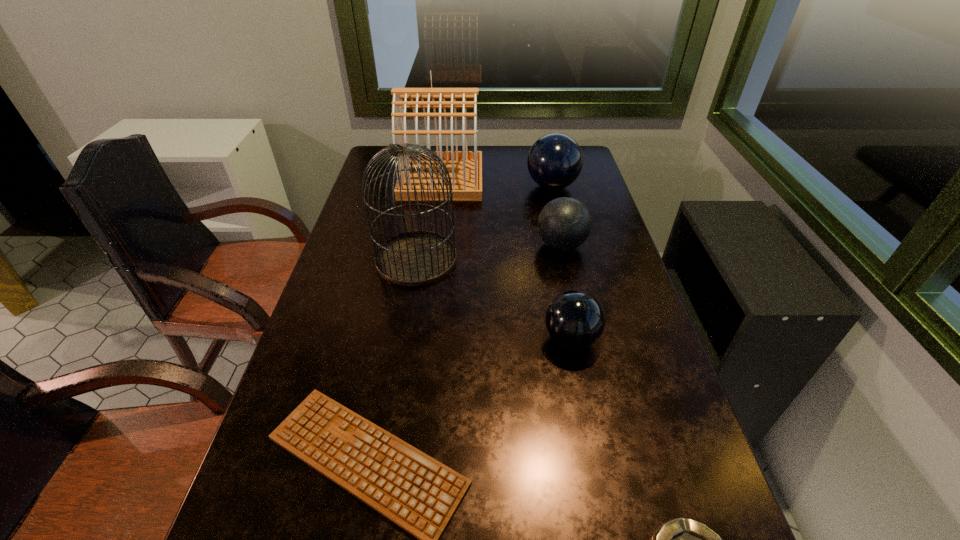
You are a GUI agent. You are given a task and a screenshot of the screen. Output one action in this format:
    pyautogui.click(x=<x>, y=<y>)
    Task: Click on the farther birdcage
    The height and width of the screenshot is (540, 960).
    Given the screenshot: What is the action you would take?
    click(465, 167)

Locate an element on the screen. the nearer birdcage is located at coordinates (414, 258).

This screenshot has height=540, width=960. In order to click on the fifth shortest object in this screenshot , I will do `click(555, 160)`.

Locate an element on the screen. the tallest bowling ball is located at coordinates click(555, 160).

Locate an element on the screen. the second nearest bowling ball is located at coordinates tap(564, 223).

In order to click on the nearest bowling ball in this screenshot , I will do `click(575, 320)`.

Locate an element on the screen. free region located 0.090m with an open door on the farther birdcage is located at coordinates (507, 179).

Locate an element on the screen. The image size is (960, 540). vacant space situated 0.250m on the back of the nearer birdcage is located at coordinates (427, 192).

This screenshot has width=960, height=540. I want to click on free space located on the surface of the farthest bowling ball near the finger holes, so click(x=440, y=186).

Where is `blank space located on the surface of the farthest bowling ball near the finger holes`? The width and height of the screenshot is (960, 540). blank space located on the surface of the farthest bowling ball near the finger holes is located at coordinates (434, 186).